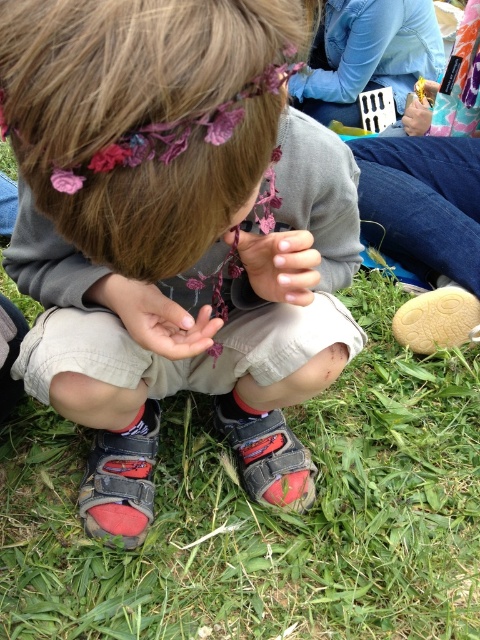
Question: Does matte gray sweatshirt at center appear under tan suede sandal at lower right?

Choices:
 (A) yes
 (B) no

Answer: (B)

Question: Which of the following is the farthest from the observer?

Choices:
 (A) (311, 486)
 (B) (414, 112)
 (C) (372, 273)

Answer: (B)

Question: Can you confirm if green grass at lower center is positioned to the left of red rubber sandal at lower left?

Choices:
 (A) yes
 (B) no

Answer: (B)

Question: Which is nearer to the leather sandal at lower right?

Choices:
 (A) matte gray sweatshirt at center
 (B) red suede sandal at lower center
 (C) matte pink hand at center
 (D) green grass at lower center

Answer: (D)

Question: Does matte gray sweatshirt at center have a smaller size compared to red rubber sandal at lower left?

Choices:
 (A) no
 (B) yes

Answer: (A)

Question: Which is nearer to the matte pink flower at center?

Choices:
 (A) red suede sandal at lower center
 (B) leather sandal at lower right

Answer: (A)